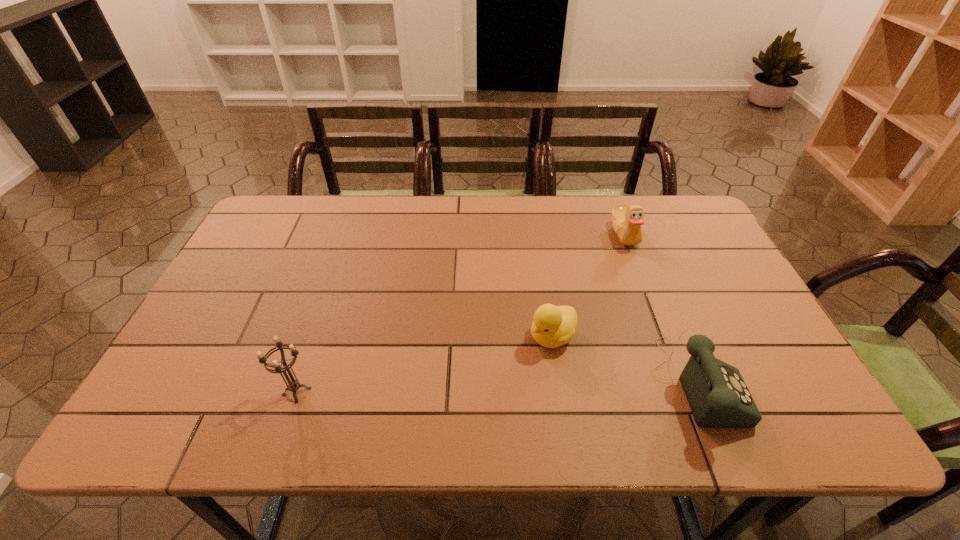
Identify the location of vacant space situated 0.330m at the beak of the right duck. (558, 305).

Find the location of a particular element. The width and height of the screenshot is (960, 540). vacant space situated at the beak of the right duck is located at coordinates (573, 291).

This screenshot has width=960, height=540. Find the location of `vacant space situated on the front-facing side of the nearer duck`. vacant space situated on the front-facing side of the nearer duck is located at coordinates (522, 359).

At what (x,y) coordinates should I click in order to perform the action: click on vacant space located on the front-facing side of the nearer duck. Please return your answer as a coordinate pair (x, y). The height and width of the screenshot is (540, 960). Looking at the image, I should click on (500, 375).

You are a GUI agent. You are given a task and a screenshot of the screen. Output one action in this format:
    pyautogui.click(x=<x>, y=<y>)
    Task: Click on the object located at the far edge
    The image size is (960, 540).
    Given the screenshot: What is the action you would take?
    pyautogui.click(x=626, y=220)

This screenshot has height=540, width=960. Find the location of `candle holder positioned at the near edge`. candle holder positioned at the near edge is located at coordinates (293, 386).

This screenshot has height=540, width=960. I want to click on telephone that is at the near edge, so (x=718, y=397).

Where is `object located in the right edge section of the desktop`? The height and width of the screenshot is (540, 960). object located in the right edge section of the desktop is located at coordinates (718, 397).

Find the location of a particular element. This screenshot has width=960, height=540. object positioned at the near right corner is located at coordinates (718, 397).

In the image, there is a desktop. At what (x,y) coordinates should I click in order to perform the action: click on free region at the far edge. Please return your answer as a coordinate pair (x, y). The width and height of the screenshot is (960, 540). Looking at the image, I should click on 406,234.